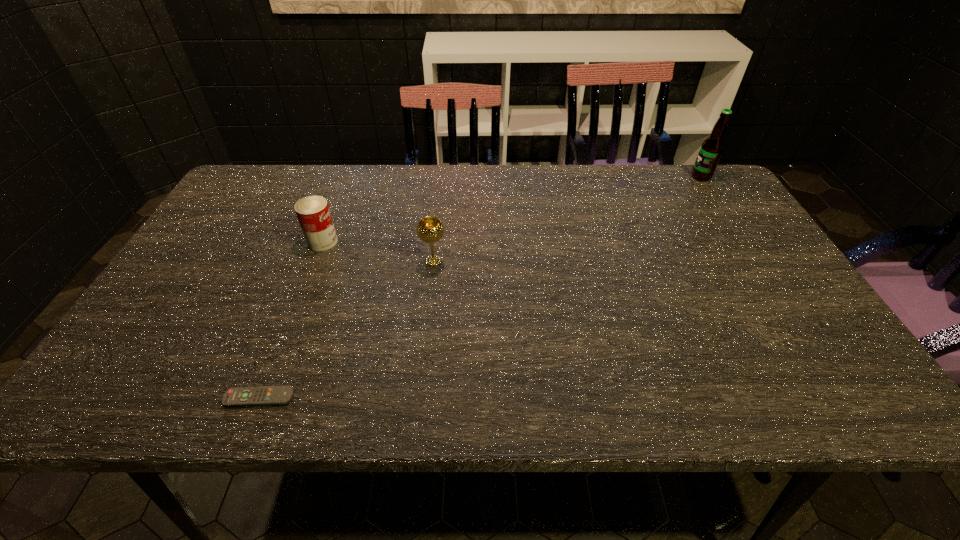
At what (x,y) coordinates should I click in order to perform the action: click on free space at the near left corner. Please return your answer as a coordinate pair (x, y). Looking at the image, I should click on (139, 389).

Identify the location of vacant space at the far right corner. This screenshot has height=540, width=960. (702, 198).

I want to click on vacant space that's between the third nearest object and the farthest object, so click(512, 209).

You are a GUI agent. You are given a task and a screenshot of the screen. Output one action in this format:
    pyautogui.click(x=<x>, y=<y>)
    Task: Click on the vacant space that's between the chalice and the can
    
    Given the screenshot: What is the action you would take?
    pyautogui.click(x=378, y=251)

What are the coordinates of `free space between the beer bottle and the shortest object` in the screenshot? It's located at (480, 287).

Where is `vacant point located between the rightmost object and the third nearest object`? vacant point located between the rightmost object and the third nearest object is located at coordinates (512, 209).

Where is `free space between the third nearest object and the beer bottle`? Image resolution: width=960 pixels, height=540 pixels. free space between the third nearest object and the beer bottle is located at coordinates (512, 209).

Image resolution: width=960 pixels, height=540 pixels. I want to click on blank region between the chalice and the beer bottle, so click(x=567, y=219).

Locate an element on the screen. vacant space in between the tallest object and the remote control is located at coordinates (480, 287).

The height and width of the screenshot is (540, 960). What are the coordinates of `free space between the beer bottle and the third nearest object` in the screenshot? It's located at (512, 209).